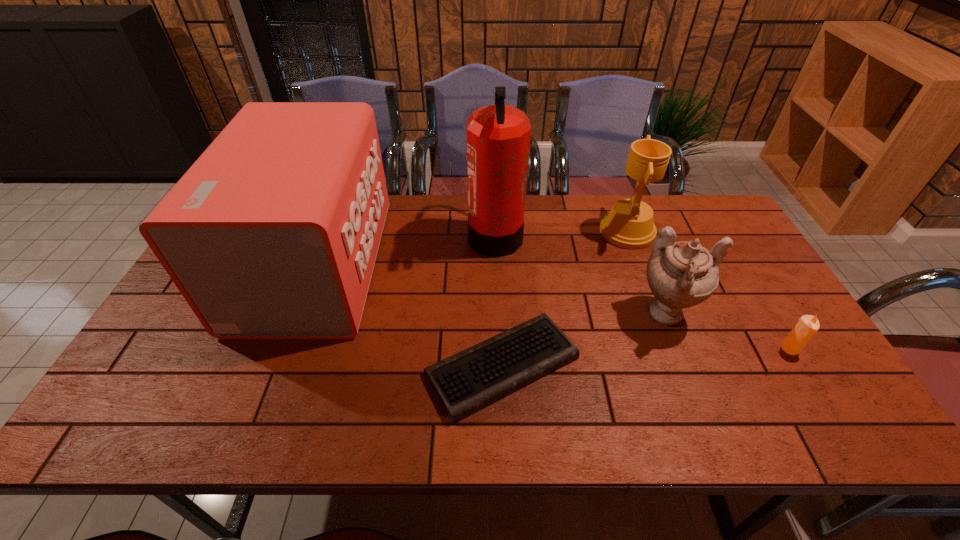
Locate an element on the screen. object that is at the left edge is located at coordinates (273, 232).

Where is `object at the right edge`? object at the right edge is located at coordinates (808, 325).

Identify the location of object that is at the far left corner. This screenshot has height=540, width=960. (273, 232).

You are a GUI agent. You are given a task and a screenshot of the screen. Output one action in this format:
    pyautogui.click(x=<x>, y=<y>)
    Task: Click on the blank space at the far edge of the desktop
    This screenshot has width=960, height=540.
    Given the screenshot: What is the action you would take?
    pyautogui.click(x=673, y=215)

At what (x,y) coordinates should I click in order to perform the action: click on free space at the near edge of the desktop. Please return your answer as a coordinate pair (x, y). The width and height of the screenshot is (960, 540). Looking at the image, I should click on (542, 419).

Identify the location of vacant space at the right edge. [x=768, y=392].

Where is `vacant position at the near left corner of the desktop`? vacant position at the near left corner of the desktop is located at coordinates (171, 410).

Locate an element on the screen. Image resolution: width=960 pixels, height=540 pixels. vacant space at the far right corner of the desktop is located at coordinates (711, 217).

Find the location of `vacant region at the near right corner of the desktop`. vacant region at the near right corner of the desktop is located at coordinates (828, 409).

The image size is (960, 540). In order to click on blank region between the fifth tallest object and the urn in this screenshot , I will do `click(729, 332)`.